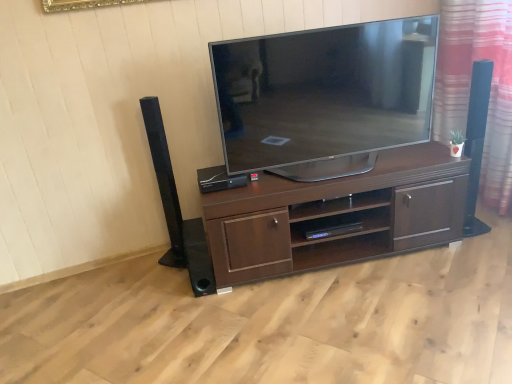
Question: Is velvet-like red curtain at right beside black plastic speaker at center, which is the third speaker in left-to-right order?

Choices:
 (A) no
 (B) yes

Answer: (A)

Question: Is velvet-like red curtain at right closer to the viewer compared to black plastic speaker at center, which is the third speaker in left-to-right order?

Choices:
 (A) no
 (B) yes

Answer: (B)

Question: Does velvet-like red curtain at right have a smaller size compared to black plastic speaker at center, which is the third speaker in left-to-right order?

Choices:
 (A) no
 (B) yes

Answer: (A)

Question: Can you confirm if velvet-like red curtain at right is bigger than black plastic speaker at center, arranged as the 1th speaker when viewed from the right?

Choices:
 (A) yes
 (B) no

Answer: (A)

Question: Can you confirm if velvet-like red curtain at right is taller than black plastic speaker at center, which is the third speaker in left-to-right order?

Choices:
 (A) no
 (B) yes

Answer: (B)

Question: From the image's perspective, is velvet-like red curtain at right over black plastic speaker at center, which is the third speaker in left-to-right order?

Choices:
 (A) yes
 (B) no

Answer: (A)

Question: Is velvet-like red curtain at right taller than black matte speaker at lower center, the 2th speaker from the right?

Choices:
 (A) no
 (B) yes

Answer: (B)

Question: From the image's perspective, is velvet-like red curtain at right under black matte speaker at lower center, acting as the 2th speaker starting from the left?

Choices:
 (A) yes
 (B) no

Answer: (B)

Question: Considering the relative positions of velvet-like red curtain at right and black matte speaker at lower center, the 2th speaker from the right, in the image provided, is velvet-like red curtain at right behind black matte speaker at lower center, the 2th speaker from the right,?

Choices:
 (A) no
 (B) yes

Answer: (A)

Question: Is velvet-like red curtain at right oriented away from black matte speaker at lower center, the 2th speaker from the right?

Choices:
 (A) yes
 (B) no

Answer: (B)

Question: Is velvet-like red curtain at right positioned in front of black matte speaker at lower center, the 2th speaker from the right?

Choices:
 (A) yes
 (B) no

Answer: (A)

Question: Can we say velvet-like red curtain at right lies outside black matte speaker at lower center, acting as the 2th speaker starting from the left?

Choices:
 (A) no
 (B) yes

Answer: (B)

Question: Is black plastic speaker at center, arranged as the 1th speaker when viewed from the right, thinner than velvet-like red curtain at right?

Choices:
 (A) no
 (B) yes

Answer: (A)